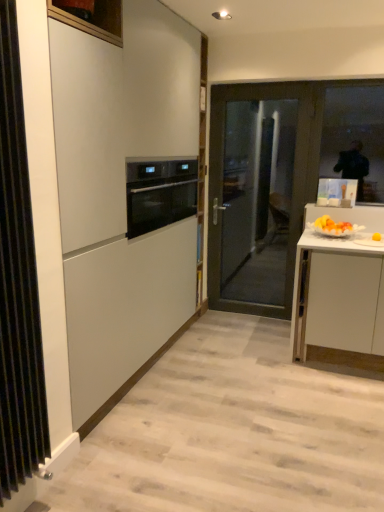
Question: Does matte white cabinet at center have a larger size compared to dark gray glass door at center?

Choices:
 (A) no
 (B) yes

Answer: (B)

Question: Can you confirm if matte white cabinet at center is thinner than dark gray glass door at center?

Choices:
 (A) no
 (B) yes

Answer: (A)

Question: Considering the relative sizes of matte white cabinet at center and dark gray glass door at center in the image provided, is matte white cabinet at center taller than dark gray glass door at center?

Choices:
 (A) no
 (B) yes

Answer: (B)

Question: Is matte white cabinet at center further to camera compared to dark gray glass door at center?

Choices:
 (A) no
 (B) yes

Answer: (A)

Question: From the image's perspective, is matte white cabinet at center beneath dark gray glass door at center?

Choices:
 (A) yes
 (B) no

Answer: (A)

Question: Is black metal radiator at left to the left or to the right of transparent glass window at upper right in the image?

Choices:
 (A) left
 (B) right

Answer: (A)

Question: From a real-world perspective, relative to transparent glass window at upper right, is black metal radiator at left vertically above or below?

Choices:
 (A) below
 (B) above

Answer: (A)

Question: In terms of height, does black metal radiator at left look taller or shorter compared to transparent glass window at upper right?

Choices:
 (A) tall
 (B) short

Answer: (A)

Question: Is black metal radiator at left in front of or behind transparent glass window at upper right in the image?

Choices:
 (A) behind
 (B) front

Answer: (B)

Question: Based on their positions, is black glass oven at center located to the left or right of matte white cabinet at center?

Choices:
 (A) right
 (B) left

Answer: (A)

Question: From a real-world perspective, relative to matte white cabinet at center, is black glass oven at center vertically above or below?

Choices:
 (A) below
 (B) above

Answer: (B)

Question: Considering the positions of black glass oven at center and matte white cabinet at center in the image, is black glass oven at center taller or shorter than matte white cabinet at center?

Choices:
 (A) short
 (B) tall

Answer: (A)

Question: Considering the positions of black glass oven at center and matte white cabinet at center in the image, is black glass oven at center wider or thinner than matte white cabinet at center?

Choices:
 (A) wide
 (B) thin

Answer: (A)

Question: From the image's perspective, is matte white cabinet at center located above or below black metal radiator at left?

Choices:
 (A) below
 (B) above

Answer: (B)

Question: Would you say matte white cabinet at center is inside or outside black metal radiator at left?

Choices:
 (A) outside
 (B) inside

Answer: (A)